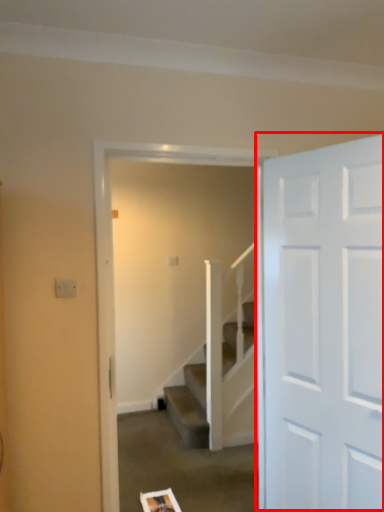
Question: From the image's perspective, considering the relative positions of door (annotated by the red box) and screen door in the image provided, where is door (annotated by the red box) located with respect to the staircase?

Choices:
 (A) below
 (B) above

Answer: (B)